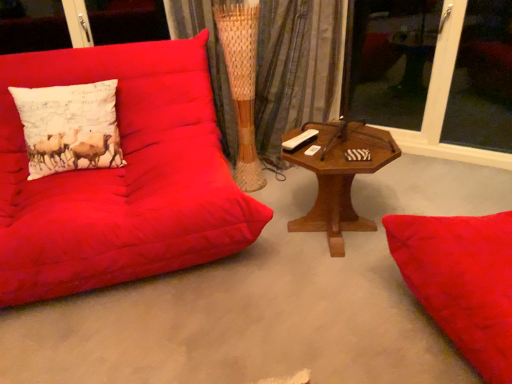
Find the location of a particular element. This screenshot has width=512, height=384. vacant space in front of woven fabric curtain at center is located at coordinates (290, 182).